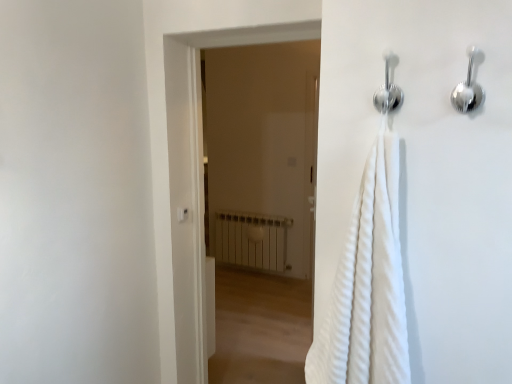
Question: Would you say white matte radiator at center is part of chrome metallic shower at upper center, which appears as the second shower when viewed from the right,'s contents?

Choices:
 (A) no
 (B) yes

Answer: (A)

Question: Is chrome metallic shower at upper center, the first shower from the left, to the left of white matte radiator at center from the viewer's perspective?

Choices:
 (A) no
 (B) yes

Answer: (A)

Question: Is chrome metallic shower at upper center, which appears as the second shower when viewed from the right, to the right of white matte radiator at center from the viewer's perspective?

Choices:
 (A) yes
 (B) no

Answer: (A)

Question: Would you consider chrome metallic shower at upper center, which appears as the second shower when viewed from the right, to be distant from white matte radiator at center?

Choices:
 (A) yes
 (B) no

Answer: (A)

Question: Is chrome metallic shower at upper center, the first shower from the left, not within white matte radiator at center?

Choices:
 (A) yes
 (B) no

Answer: (A)

Question: Considering the relative sizes of chrome metallic shower at upper center, which appears as the second shower when viewed from the right, and white matte radiator at center in the image provided, is chrome metallic shower at upper center, which appears as the second shower when viewed from the right, wider than white matte radiator at center?

Choices:
 (A) no
 (B) yes

Answer: (A)

Question: Is white matte radiator at center at the back of satin silver shower at upper right, which appears as the second shower when viewed from the left?

Choices:
 (A) yes
 (B) no

Answer: (B)

Question: Is satin silver shower at upper right, the 1th shower when ordered from right to left, wider than white matte radiator at center?

Choices:
 (A) yes
 (B) no

Answer: (B)

Question: Is satin silver shower at upper right, which appears as the second shower when viewed from the left, positioned beyond the bounds of white matte radiator at center?

Choices:
 (A) yes
 (B) no

Answer: (A)

Question: Is satin silver shower at upper right, which appears as the second shower when viewed from the left, in front of white matte radiator at center?

Choices:
 (A) yes
 (B) no

Answer: (A)

Question: Can you confirm if satin silver shower at upper right, the 1th shower when ordered from right to left, is smaller than white matte radiator at center?

Choices:
 (A) yes
 (B) no

Answer: (A)

Question: From the image's perspective, is satin silver shower at upper right, the 1th shower when ordered from right to left, beneath white matte radiator at center?

Choices:
 (A) no
 (B) yes

Answer: (A)

Question: Considering the relative sizes of white plastic light switch at upper center and satin silver shower at upper right, the 1th shower when ordered from right to left, in the image provided, is white plastic light switch at upper center bigger than satin silver shower at upper right, the 1th shower when ordered from right to left,?

Choices:
 (A) yes
 (B) no

Answer: (B)